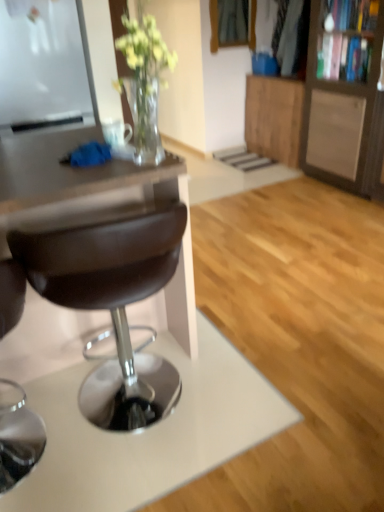
The width and height of the screenshot is (384, 512). Describe the element at coordinates (344, 96) in the screenshot. I see `wooden cabinet at right, arranged as the 1th cabinetry when viewed from the front` at that location.

What do you see at coordinates (94, 201) in the screenshot?
I see `brown leather desk at left` at bounding box center [94, 201].

The width and height of the screenshot is (384, 512). I want to click on wooden cabinet at upper right, placed as the second cabinetry when sorted from front to back, so click(274, 117).

Measure the distance between point (261, 121) and camera.

A distance of 4.26 meters exists between point (261, 121) and camera.

The height and width of the screenshot is (512, 384). I want to click on wooden cabinet at right, arranged as the 1th cabinetry when viewed from the front, so (x=344, y=96).

Visually, is wooden cabinet at upper right, placed as the second cabinetry when sorted from front to back, positioned to the left or to the right of wooden cabinet at right, which appears as the 2th cabinetry when viewed from the back?

wooden cabinet at upper right, placed as the second cabinetry when sorted from front to back, is to the left of wooden cabinet at right, which appears as the 2th cabinetry when viewed from the back.

Is point (298, 142) closer or farther from the camera than point (330, 41)?

Point (298, 142) is farther from the camera than point (330, 41).

Relative to wooden cabinet at right, which appears as the 2th cabinetry when viewed from the back, is wooden cabinet at upper right, placed as the second cabinetry when sorted from front to back, in front or behind?

wooden cabinet at upper right, placed as the second cabinetry when sorted from front to back, is positioned farther from the viewer than wooden cabinet at right, which appears as the 2th cabinetry when viewed from the back.

Is wooden cabinet at upper right, positioned as the 1th cabinetry in back-to-front order, not near wooden cabinet at right, which appears as the 2th cabinetry when viewed from the back?

No, there isn't a large distance between wooden cabinet at upper right, positioned as the 1th cabinetry in back-to-front order, and wooden cabinet at right, which appears as the 2th cabinetry when viewed from the back.

How different are the orientations of wooden cabinet at right, which appears as the 2th cabinetry when viewed from the back, and brown leather stool at center in degrees?

The facing directions of wooden cabinet at right, which appears as the 2th cabinetry when viewed from the back, and brown leather stool at center are 88.2 degrees apart.

Considering the relative sizes of wooden cabinet at right, which appears as the 2th cabinetry when viewed from the back, and brown leather stool at center in the image provided, is wooden cabinet at right, which appears as the 2th cabinetry when viewed from the back, thinner than brown leather stool at center?

Incorrect, the width of wooden cabinet at right, which appears as the 2th cabinetry when viewed from the back, is not less than that of brown leather stool at center.

Would you say brown leather stool at center is part of wooden cabinet at right, which appears as the 2th cabinetry when viewed from the back,'s contents?

No, brown leather stool at center is not a part of wooden cabinet at right, which appears as the 2th cabinetry when viewed from the back.

From the image's perspective, is brown leather desk at left under brown leather stool at center?

No, from the image's perspective, brown leather desk at left is not beneath brown leather stool at center.

Considering the relative sizes of brown leather desk at left and brown leather stool at center in the image provided, is brown leather desk at left smaller than brown leather stool at center?

Actually, brown leather desk at left might be larger than brown leather stool at center.

Is brown leather desk at left with brown leather stool at center?

brown leather desk at left is not next to brown leather stool at center, and they're not touching.

Between brown leather desk at left and brown leather stool at center, which one has smaller width?

With smaller width is brown leather stool at center.

Consider the image. Is wooden cabinet at upper right, placed as the second cabinetry when sorted from front to back, facing towards brown leather desk at left?

No.

From the image's perspective, which one is positioned higher, wooden cabinet at upper right, positioned as the 1th cabinetry in back-to-front order, or brown leather desk at left?

wooden cabinet at upper right, positioned as the 1th cabinetry in back-to-front order, from the image's perspective.

From the picture: Is wooden cabinet at upper right, positioned as the 1th cabinetry in back-to-front order, surrounding brown leather desk at left?

No, brown leather desk at left is not inside wooden cabinet at upper right, positioned as the 1th cabinetry in back-to-front order.

Considering the positions of objects wooden cabinet at upper right, placed as the second cabinetry when sorted from front to back, and brown leather desk at left in the image provided, who is more to the right, wooden cabinet at upper right, placed as the second cabinetry when sorted from front to back, or brown leather desk at left?

wooden cabinet at upper right, placed as the second cabinetry when sorted from front to back, is more to the right.

Is wooden cabinet at upper right, placed as the second cabinetry when sorted from front to back, to the right of brown leather stool at center from the viewer's perspective?

Indeed, wooden cabinet at upper right, placed as the second cabinetry when sorted from front to back, is positioned on the right side of brown leather stool at center.

In the scene shown: Would you consider wooden cabinet at upper right, positioned as the 1th cabinetry in back-to-front order, to be distant from brown leather stool at center?

Yes.

Is point (291, 158) positioned behind point (73, 289)?

Yes.

Can you confirm if wooden cabinet at upper right, placed as the second cabinetry when sorted from front to back, is wider than brown leather stool at center?

Incorrect, the width of wooden cabinet at upper right, placed as the second cabinetry when sorted from front to back, does not surpass that of brown leather stool at center.

Considering the sizes of objects brown leather stool at center and wooden cabinet at upper right, positioned as the 1th cabinetry in back-to-front order, in the image provided, who is thinner, brown leather stool at center or wooden cabinet at upper right, positioned as the 1th cabinetry in back-to-front order,?

wooden cabinet at upper right, positioned as the 1th cabinetry in back-to-front order.

From the image's perspective, which is below, brown leather stool at center or wooden cabinet at upper right, placed as the second cabinetry when sorted from front to back?

From the image's view, brown leather stool at center is below.

Is brown leather stool at center positioned far away from wooden cabinet at upper right, placed as the second cabinetry when sorted from front to back?

Yes, brown leather stool at center and wooden cabinet at upper right, placed as the second cabinetry when sorted from front to back, are located far from each other.

Is wooden cabinet at upper right, positioned as the 1th cabinetry in back-to-front order, completely or partially inside brown leather stool at center?

No, wooden cabinet at upper right, positioned as the 1th cabinetry in back-to-front order, is not inside brown leather stool at center.

Considering the sizes of objects wooden cabinet at right, which appears as the 2th cabinetry when viewed from the back, and brown leather desk at left in the image provided, who is taller, wooden cabinet at right, which appears as the 2th cabinetry when viewed from the back, or brown leather desk at left?

Standing taller between the two is wooden cabinet at right, which appears as the 2th cabinetry when viewed from the back.

Does wooden cabinet at right, arranged as the 1th cabinetry when viewed from the front, touch brown leather desk at left?

No, wooden cabinet at right, arranged as the 1th cabinetry when viewed from the front, is not next to brown leather desk at left.

Measure the distance between wooden cabinet at right, which appears as the 2th cabinetry when viewed from the back, and brown leather desk at left.

7.16 feet.

Could you tell me if wooden cabinet at right, which appears as the 2th cabinetry when viewed from the back, is facing brown leather desk at left?

Yes, wooden cabinet at right, which appears as the 2th cabinetry when viewed from the back, faces towards brown leather desk at left.

Locate an element on the screen. cabinetry that is below the wooden cabinet at upper right, positioned as the 1th cabinetry in back-to-front order (from the image's perspective) is located at coordinates (344, 96).

Identify the location of chair that appears below the wooden cabinet at right, arranged as the 1th cabinetry when viewed from the front (from a real-world perspective). (111, 297).

From the image, which object appears to be nearer to brown leather stool at center, wooden cabinet at right, arranged as the 1th cabinetry when viewed from the front, or brown leather desk at left?

The object closer to brown leather stool at center is brown leather desk at left.

Consider the image. Considering their positions, is brown leather stool at center positioned closer to wooden cabinet at upper right, placed as the second cabinetry when sorted from front to back, than wooden cabinet at right, arranged as the 1th cabinetry when viewed from the front?

wooden cabinet at right, arranged as the 1th cabinetry when viewed from the front, is positioned closer to the anchor wooden cabinet at upper right, placed as the second cabinetry when sorted from front to back.

Based on their spatial positions, is brown leather desk at left or brown leather stool at center closer to wooden cabinet at upper right, positioned as the 1th cabinetry in back-to-front order?

Among the two, brown leather desk at left is located nearer to wooden cabinet at upper right, positioned as the 1th cabinetry in back-to-front order.

When comparing their distances from brown leather desk at left, does wooden cabinet at upper right, placed as the second cabinetry when sorted from front to back, or brown leather stool at center seem closer?

Based on the image, brown leather stool at center appears to be nearer to brown leather desk at left.

Estimate the real-world distances between objects in this image. Which object is further from brown leather stool at center, wooden cabinet at right, which appears as the 2th cabinetry when viewed from the back, or wooden cabinet at upper right, positioned as the 1th cabinetry in back-to-front order?

wooden cabinet at upper right, positioned as the 1th cabinetry in back-to-front order, is further to brown leather stool at center.

Looking at the image, which one is located closer to wooden cabinet at right, arranged as the 1th cabinetry when viewed from the front, brown leather desk at left or brown leather stool at center?

brown leather desk at left is positioned closer to the anchor wooden cabinet at right, arranged as the 1th cabinetry when viewed from the front.

From the picture: When comparing their distances from wooden cabinet at upper right, placed as the second cabinetry when sorted from front to back, does wooden cabinet at right, arranged as the 1th cabinetry when viewed from the front, or brown leather desk at left seem further?

brown leather desk at left is further to wooden cabinet at upper right, placed as the second cabinetry when sorted from front to back.

Considering their positions, is brown leather stool at center positioned further to wooden cabinet at upper right, positioned as the 1th cabinetry in back-to-front order, than brown leather desk at left?

Based on the image, brown leather stool at center appears to be further to wooden cabinet at upper right, positioned as the 1th cabinetry in back-to-front order.

At what (x,y) coordinates should I click in order to perform the action: click on cabinetry positioned between brown leather stool at center and wooden cabinet at upper right, placed as the second cabinetry when sorted from front to back, from near to far. Please return your answer as a coordinate pair (x, y). This screenshot has width=384, height=512. Looking at the image, I should click on (344, 96).

You are a GUI agent. You are given a task and a screenshot of the screen. Output one action in this format:
    pyautogui.click(x=<x>, y=<y>)
    Task: Click on the cabinetry between brown leather desk at left and wooden cabinet at upper right, placed as the second cabinetry when sorted from front to back, in the front-back direction
    
    Given the screenshot: What is the action you would take?
    pyautogui.click(x=344, y=96)

The image size is (384, 512). In order to click on desk positioned between brown leather stool at center and wooden cabinet at upper right, placed as the second cabinetry when sorted from front to back, from near to far in this screenshot , I will do `click(94, 201)`.

I want to click on chair between brown leather desk at left and wooden cabinet at right, arranged as the 1th cabinetry when viewed from the front, in the horizontal direction, so (111, 297).